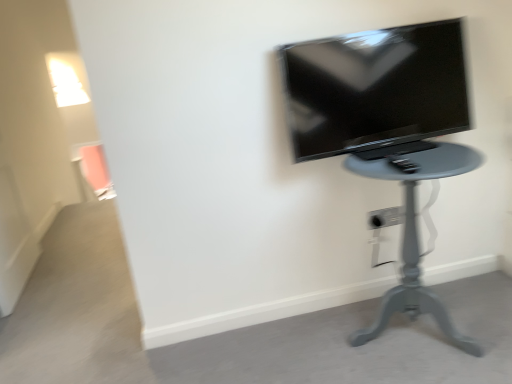
Locate an element on the screen. free space to the right of matte gray table at center is located at coordinates (480, 299).